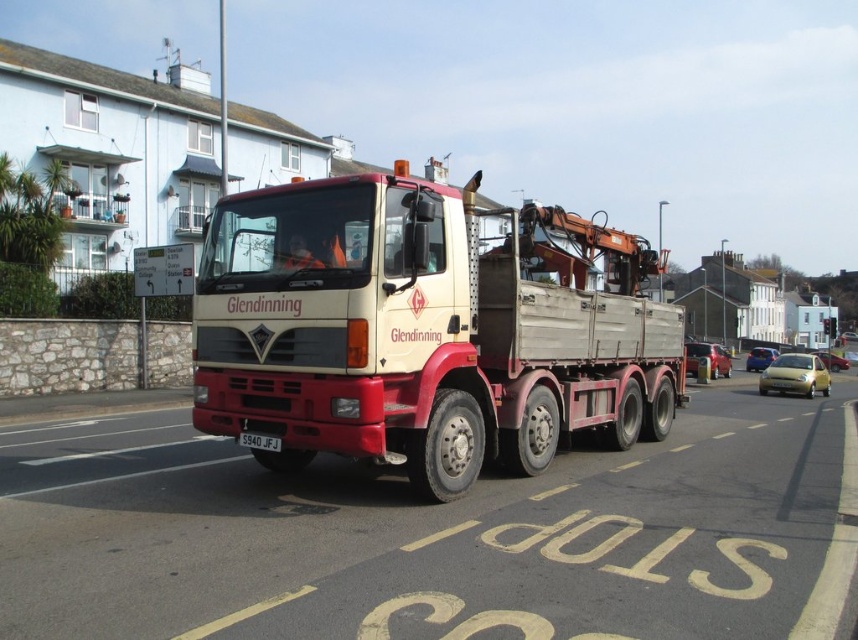
Question: Can you confirm if matte white truck at center is positioned above metallic gold taxi at right?

Choices:
 (A) no
 (B) yes

Answer: (B)

Question: Which point is closer to the camera?

Choices:
 (A) matte white truck at center
 (B) white plastic license plate at center

Answer: (A)

Question: Does matte white truck at center have a larger size compared to metallic gold taxi at right?

Choices:
 (A) no
 (B) yes

Answer: (B)

Question: Among these points, which one is nearest to the camera?

Choices:
 (A) (529, 422)
 (B) (255, 448)
 (C) (811, 362)

Answer: (B)

Question: Can you confirm if metallic gold taxi at right is smaller than white plastic license plate at center?

Choices:
 (A) no
 (B) yes

Answer: (A)

Question: Which point is closer to the camera?

Choices:
 (A) white plastic license plate at center
 (B) metallic gold taxi at right
 (C) matte white truck at center

Answer: (C)